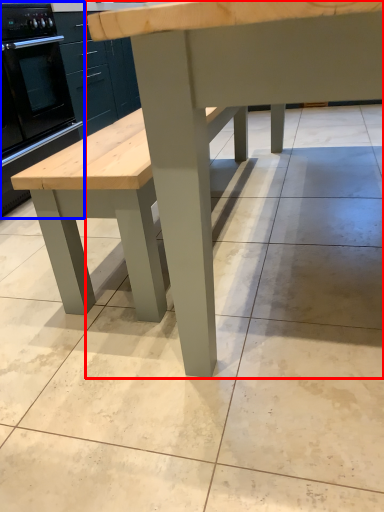
Question: Which point is closer to the camera, table (highlighted by a red box) or oven (highlighted by a blue box)?

Choices:
 (A) table
 (B) oven

Answer: (A)